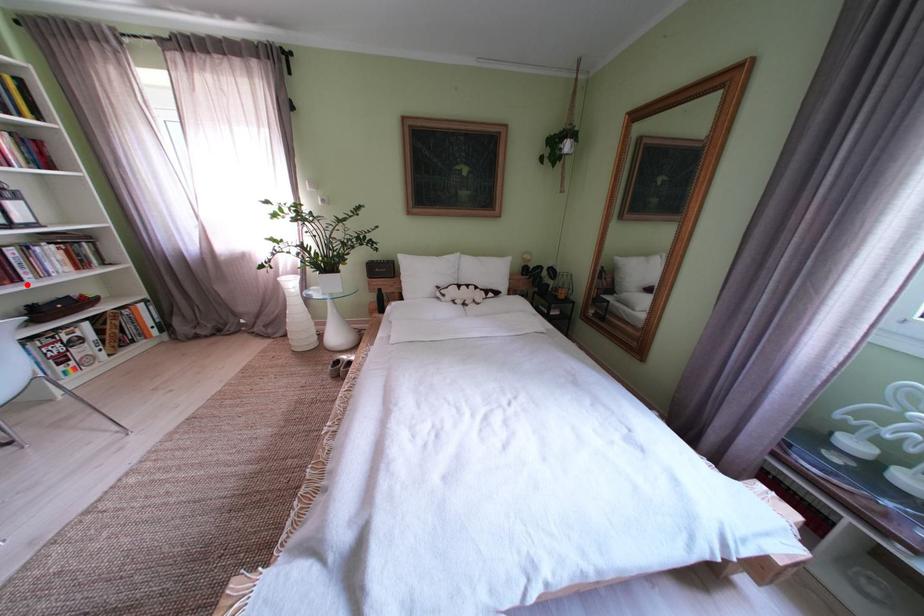
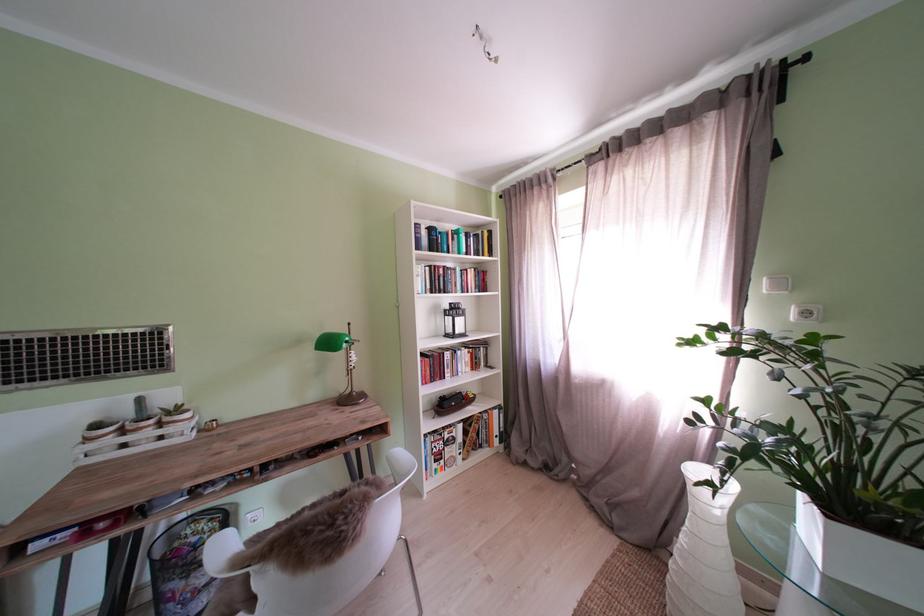
Question: I am providing you with two images of the same scene from different viewpoints. Image1 has a red point marked. In image2, the corresponding 3D location appears at what relative position? Reply with the corresponding letter.

Choices:
 (A) Closer
 (B) Farther

Answer: (A)